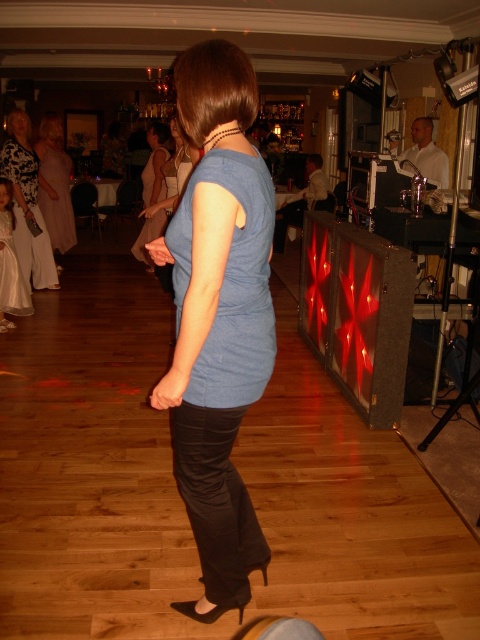
You are a photographer at the party and want to capture both the matte blue shirt at center and the satin beige dress at center in the same frame. Which object should you focus on first to ensure both are in the frame?

Since the matte blue shirt at center is smaller in size compared to the satin beige dress at center, you should focus on the satin beige dress at center first to ensure both fit within the frame.

You are at a party and see two outfits at the center of the room. The matte blue shirt at center and the satin beige dress at center. Which one is positioned lower?

The matte blue shirt at center is below the satin beige dress at center, so the matte blue shirt at center is positioned lower.

You are standing at the point with coordinates point (11,294) and want to move to the point with coordinates point (51,140). Is the point you want to reach located behind or in front of your current position?

The point (51,140) is behind point (11,294), so the desired location is behind your current position.